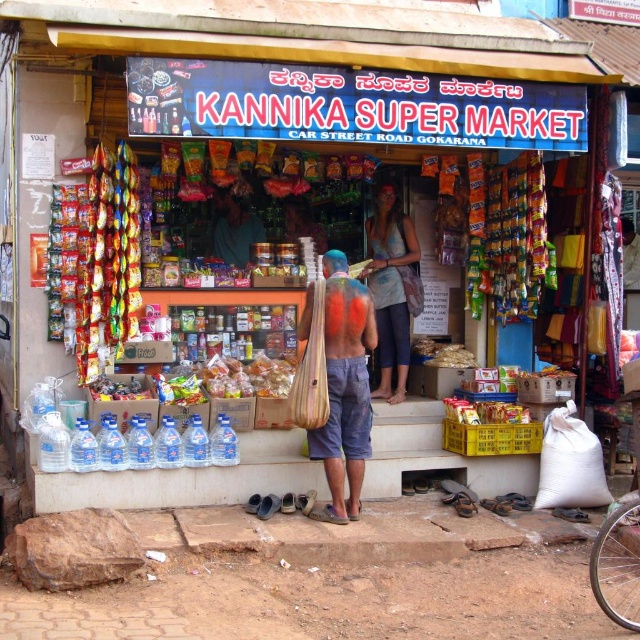
Can you confirm if multicolored fabric bag at center is bigger than shiny plastic bottle at lower left?

Yes.

Can you confirm if multicolored fabric bag at center is positioned to the left of shiny plastic bottle at lower left?

In fact, multicolored fabric bag at center is to the right of shiny plastic bottle at lower left.

Is point (371, 273) less distant than point (141, 396)?

No.

At what (x,y) coordinates should I click in order to perform the action: click on multicolored fabric bag at center. Please return your answer as a coordinate pair (x, y). The height and width of the screenshot is (640, 640). Looking at the image, I should click on (x=392, y=289).

Is matte plastic snack at center wider than shiny plastic bottle at lower left?

Indeed, matte plastic snack at center has a greater width compared to shiny plastic bottle at lower left.

Does point (445, 403) lie behind point (93, 397)?

Yes, point (445, 403) is behind point (93, 397).

This screenshot has height=640, width=640. Identify the location of matte plastic snack at center. (484, 412).

I want to click on matte plastic snack at center, so click(484, 412).

Is point (332, 298) closer to camera compared to point (109, 388)?

Yes, point (332, 298) is closer to viewer.

The image size is (640, 640). I want to click on striped fabric bag at center, so click(344, 388).

Where is `striped fabric bag at center`? Image resolution: width=640 pixels, height=640 pixels. striped fabric bag at center is located at coordinates [x=344, y=388].